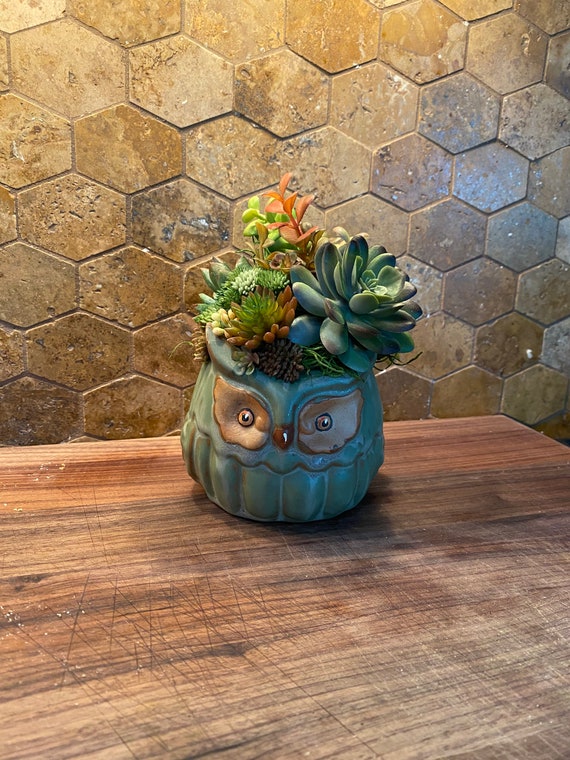
Where is `potted plant`? potted plant is located at coordinates (255, 439).